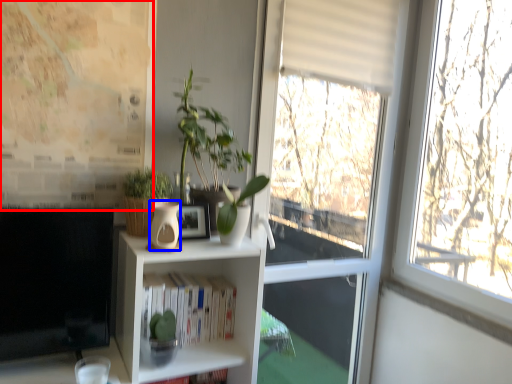
Question: Which point is further to the camera, bulletin board (highlighted by a red box) or vase (highlighted by a blue box)?

Choices:
 (A) bulletin board
 (B) vase

Answer: (A)